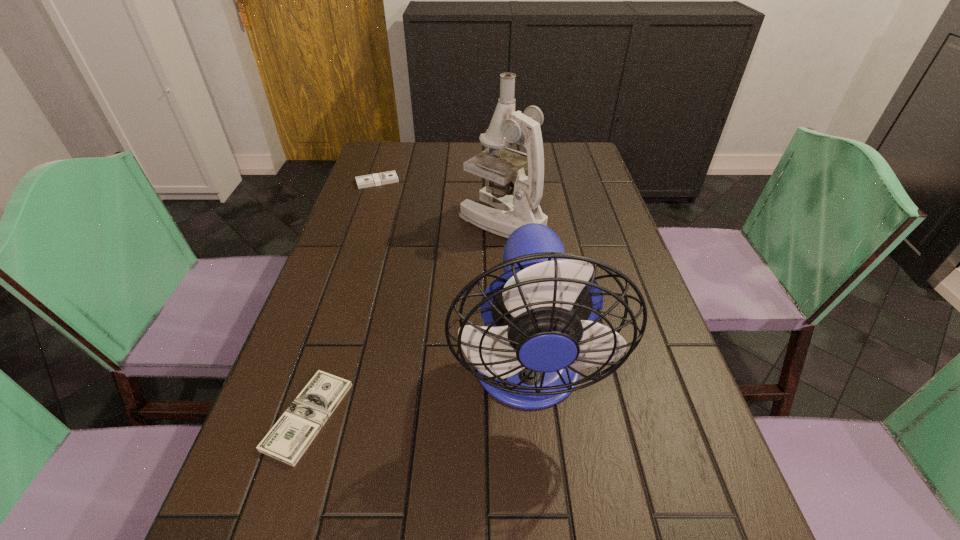
Where is `the second farthest object`? the second farthest object is located at coordinates (498, 211).

Where is `fan`? Image resolution: width=960 pixels, height=540 pixels. fan is located at coordinates (541, 314).

Identify the location of the second shortest object. Image resolution: width=960 pixels, height=540 pixels. (389, 177).

You are a GUI agent. You are given a task and a screenshot of the screen. Output one action in this format:
    pyautogui.click(x=<x>, y=<y>)
    Task: Click on the farther dollar
    
    Given the screenshot: What is the action you would take?
    pyautogui.click(x=389, y=177)

Where is `the shortest object`? the shortest object is located at coordinates (288, 439).

The width and height of the screenshot is (960, 540). In order to click on the nearer dollar in this screenshot , I will do (x=288, y=439).

Locate an element on the screen. The width and height of the screenshot is (960, 540). vacant space located on the right of the second farthest object is located at coordinates (570, 220).

This screenshot has height=540, width=960. Identify the location of blank space located on the front of the taller dollar. (356, 245).

What are the coordinates of `free space located on the back of the shorter dollar` in the screenshot? It's located at (334, 334).

At what (x,y) coordinates should I click in order to perform the action: click on object that is at the far edge. Please return your answer as a coordinate pair (x, y). This screenshot has width=960, height=540. Looking at the image, I should click on (389, 177).